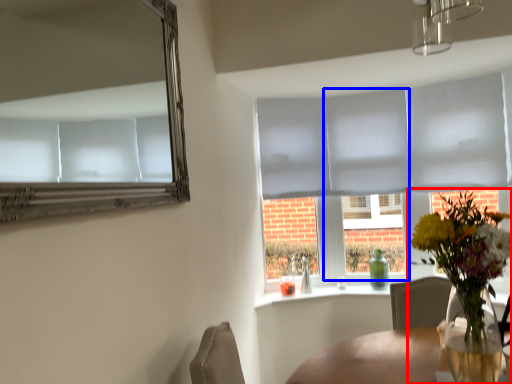
Question: Which point is closer to the camera, houseplant (highlighted by a red box) or glass door (highlighted by a blue box)?

Choices:
 (A) houseplant
 (B) glass door

Answer: (A)